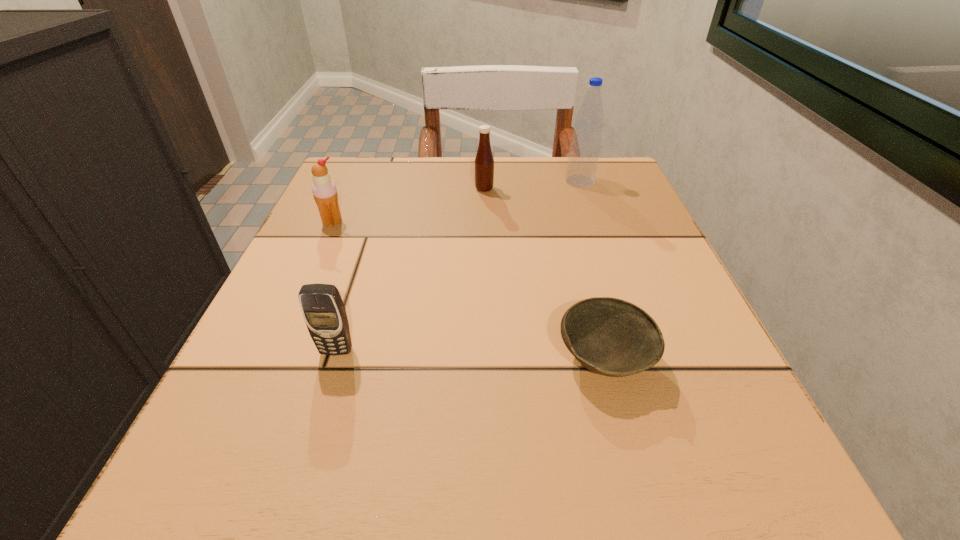
Image resolution: width=960 pixels, height=540 pixels. I want to click on the tallest object, so click(585, 147).

This screenshot has height=540, width=960. I want to click on Tabasco sauce, so click(484, 162).

The height and width of the screenshot is (540, 960). Find the location of `the third nearest object`. the third nearest object is located at coordinates (324, 190).

The width and height of the screenshot is (960, 540). I want to click on the leftmost object, so click(x=324, y=190).

Where is `cellular telephone`? The height and width of the screenshot is (540, 960). cellular telephone is located at coordinates (324, 313).

This screenshot has height=540, width=960. Find the location of `bowl`. bowl is located at coordinates (611, 337).

Locate an element on the screen. The image size is (960, 540). free space located on the back of the tallest object is located at coordinates (573, 160).

The image size is (960, 540). Identify the location of free space located 0.200m on the front of the third object from left to right. (485, 251).

Locate an element on the screen. Image resolution: width=960 pixels, height=540 pixels. vacant space located at the front with a straw on the third farthest object is located at coordinates (277, 346).

This screenshot has height=540, width=960. I want to click on free space located 0.190m on the front face of the cellular telephone, so click(x=290, y=500).